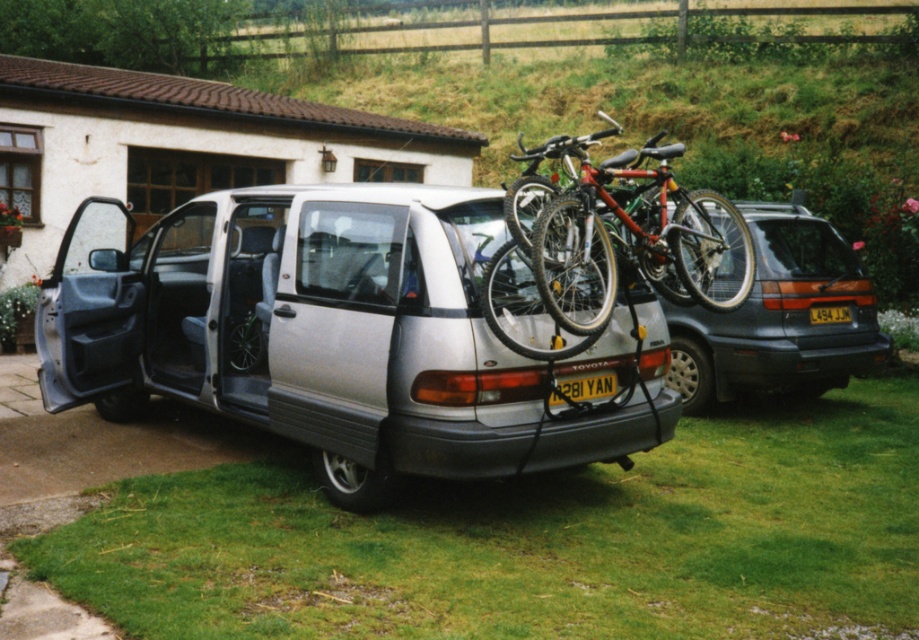
Question: Is shiny metallic bicycle at rear to the left of black plastic license plate at center from the viewer's perspective?

Choices:
 (A) yes
 (B) no

Answer: (B)

Question: Which point appears closest to the camera in this image?

Choices:
 (A) (341, 280)
 (B) (843, 308)
 (C) (712, 385)
 (D) (591, 323)

Answer: (D)

Question: Does silver metallic van at center lie behind shiny metallic bicycle at rear?

Choices:
 (A) yes
 (B) no

Answer: (B)

Question: Estimate the real-world distances between objects in this image. Which object is closer to the black plastic license plate at center?

Choices:
 (A) matte silver minivan at center
 (B) silver metallic van at center
 (C) shiny metallic bicycle at rear
 (D) yellow plastic license plate at rear

Answer: (B)

Question: Among these points, which one is farthest from the camera?

Choices:
 (A) (611, 221)
 (B) (775, 317)
 (C) (603, 384)
 (D) (814, 307)

Answer: (D)

Question: Is shiny metallic bicycle at rear wider than matte silver minivan at center?

Choices:
 (A) no
 (B) yes

Answer: (A)